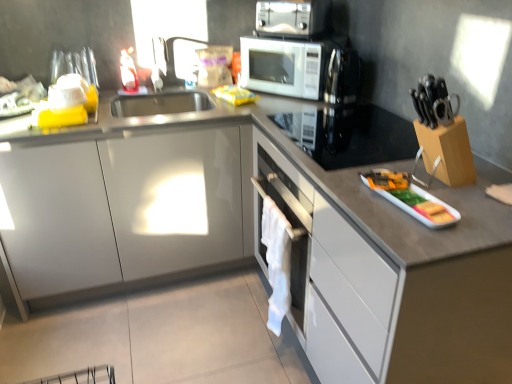
The width and height of the screenshot is (512, 384). I want to click on vacant area that is in front of white glossy tray at right, which appears as the 1th appliance when ordered from the bottom, so click(426, 235).